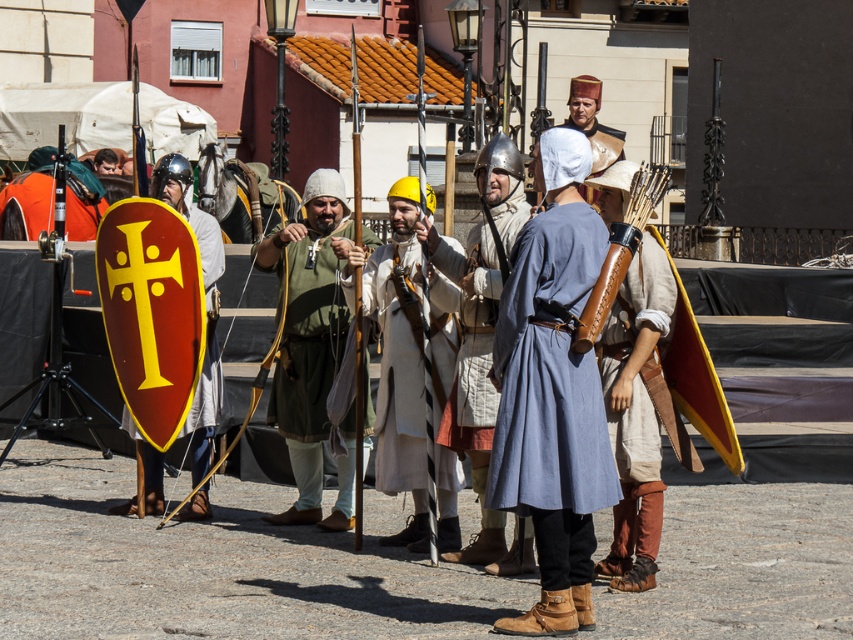
Question: Is green fabric at center bigger than matte silver helmet at center?

Choices:
 (A) no
 (B) yes

Answer: (B)

Question: Which object is positioned closest to the green fabric at center?

Choices:
 (A) white woolen coat at center
 (B) blue linen tunic at center

Answer: (A)

Question: Which point is closer to the camera?

Choices:
 (A) pos(328,525)
 (B) pos(523,529)
 (C) pos(383,419)
 (D) pos(601,490)

Answer: (D)

Question: Estimate the real-world distances between objects in this image. Which object is closer to the green fabric at center?

Choices:
 (A) blue linen tunic at center
 (B) white woolen coat at center

Answer: (B)

Question: Is green fabric at center further to camera compared to white woolen coat at center?

Choices:
 (A) yes
 (B) no

Answer: (A)

Question: Does green fabric at center appear over matte silver helmet at center?

Choices:
 (A) yes
 (B) no

Answer: (B)